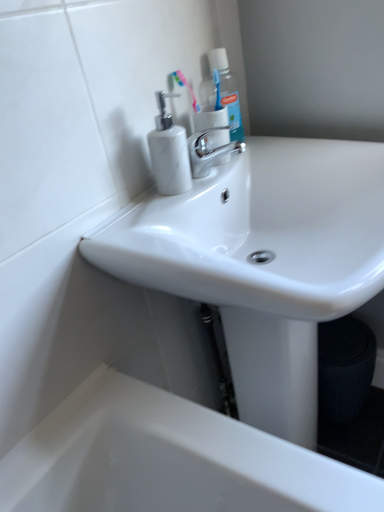
Measure the distance between point [203,95] and camera.

A distance of 37.20 inches exists between point [203,95] and camera.

What do you see at coordinates (169, 151) in the screenshot? I see `white marble soap dispenser at upper left` at bounding box center [169, 151].

Find the location of a particular element. white glossy sink at center is located at coordinates (264, 261).

The width and height of the screenshot is (384, 512). Find the location of `polished chrome faucet at center`. polished chrome faucet at center is located at coordinates (211, 150).

Who is taller, translucent plastic mouthwash at upper center or polished chrome faucet at center?

Standing taller between the two is translucent plastic mouthwash at upper center.

Is translucent plastic mouthwash at upper center facing towards polished chrome faucet at center?

No.

This screenshot has width=384, height=512. I want to click on tap below the translucent plastic mouthwash at upper center (from the image's perspective), so click(x=211, y=150).

Considering the sizes of objects white glossy toilet paper at upper center and pink plastic toothbrush at upper center in the image provided, who is thinner, white glossy toilet paper at upper center or pink plastic toothbrush at upper center?

pink plastic toothbrush at upper center.

Is white glossy toilet paper at upper center facing towards pink plastic toothbrush at upper center?

Answer: No.

Between point (212, 129) and point (197, 109), which one is positioned behind?

Positioned behind is point (197, 109).

Can you confirm if white glossy toilet paper at upper center is bigger than white glossy sink at center?

No.

Is white glossy toilet paper at upper center further to the viewer compared to white glossy sink at center?

Yes, white glossy toilet paper at upper center is behind white glossy sink at center.

From the picture: Which is more distant, (194, 120) or (270, 238)?

The point (270, 238) is farther.

Does white glossy toilet paper at upper center appear on the left side of white glossy sink at center?

Yes.

Does polished chrome faucet at center appear on the right side of translucent plastic mouthwash at upper center?

No.

Could you measure the distance between polished chrome faucet at center and translucent plastic mouthwash at upper center?

polished chrome faucet at center is 4.11 inches away from translucent plastic mouthwash at upper center.

Between polished chrome faucet at center and translucent plastic mouthwash at upper center, which one is positioned in front?

polished chrome faucet at center is in front.

Considering the sizes of polished chrome faucet at center and translucent plastic mouthwash at upper center in the image, is polished chrome faucet at center bigger or smaller than translucent plastic mouthwash at upper center?

Clearly, polished chrome faucet at center is smaller in size than translucent plastic mouthwash at upper center.

Is white glossy sink at center not near white marble soap dispenser at upper left?

No.

How different are the orientations of white glossy sink at center and white marble soap dispenser at upper left in degrees?

They differ by 1.76 degrees in their facing directions.

This screenshot has width=384, height=512. Find the location of `sink lying on the right of white marble soap dispenser at upper left`. sink lying on the right of white marble soap dispenser at upper left is located at coordinates 264,261.

Consider the image. Does white glossy sink at center have a larger size compared to white marble soap dispenser at upper left?

Yes, white glossy sink at center is bigger than white marble soap dispenser at upper left.

Is white glossy toilet paper at upper center placed right next to white marble soap dispenser at upper left?

No, white glossy toilet paper at upper center is not making contact with white marble soap dispenser at upper left.

Between point (225, 127) and point (163, 150), which one is positioned behind?

Point (225, 127)

How distant is white glossy toilet paper at upper center from white marble soap dispenser at upper left?

The distance of white glossy toilet paper at upper center from white marble soap dispenser at upper left is 4.41 inches.

Looking at the image, does white glossy toilet paper at upper center seem bigger or smaller compared to white marble soap dispenser at upper left?

Clearly, white glossy toilet paper at upper center is larger in size than white marble soap dispenser at upper left.

The width and height of the screenshot is (384, 512). Identify the location of toilet paper on the left of translucent plastic mouthwash at upper center. (212, 127).

From the image's perspective, would you say white glossy toilet paper at upper center is positioned over translucent plastic mouthwash at upper center?

No, from the image's perspective, white glossy toilet paper at upper center is not above translucent plastic mouthwash at upper center.

Can you tell me how much white glossy toilet paper at upper center and translucent plastic mouthwash at upper center differ in facing direction?

The angular difference between white glossy toilet paper at upper center and translucent plastic mouthwash at upper center is 5.34 degrees.

Looking at their sizes, would you say white glossy toilet paper at upper center is wider or thinner than translucent plastic mouthwash at upper center?

white glossy toilet paper at upper center is wider than translucent plastic mouthwash at upper center.

In the image, there is a polished chrome faucet at center. Where is `cleaning product above it (from the image's perspective)`? Image resolution: width=384 pixels, height=512 pixels. cleaning product above it (from the image's perspective) is located at coordinates (223, 91).

Locate an element on the screen. Image resolution: width=384 pixels, height=512 pixels. toothbrush located on the left of white glossy toilet paper at upper center is located at coordinates (187, 87).

Looking at the image, which one is located further to translucent plastic mouthwash at upper center, white glossy toilet paper at upper center or pink plastic toothbrush at upper center?

pink plastic toothbrush at upper center is further to translucent plastic mouthwash at upper center.

Estimate the real-world distances between objects in this image. Which object is closer to pink plastic toothbrush at upper center, white glossy toilet paper at upper center or white glossy sink at center?

white glossy toilet paper at upper center lies closer to pink plastic toothbrush at upper center than the other object.

Looking at the image, which one is located further to white marble soap dispenser at upper left, polished chrome faucet at center or pink plastic toothbrush at upper center?

The object further to white marble soap dispenser at upper left is pink plastic toothbrush at upper center.

From the image, which object appears to be farther from translucent plastic mouthwash at upper center, white glossy sink at center or pink plastic toothbrush at upper center?

white glossy sink at center is further to translucent plastic mouthwash at upper center.

Which object lies nearer to the anchor point polished chrome faucet at center, translucent plastic mouthwash at upper center or white glossy toilet paper at upper center?

Among the two, white glossy toilet paper at upper center is located nearer to polished chrome faucet at center.

Considering their positions, is white glossy toilet paper at upper center positioned closer to white marble soap dispenser at upper left than polished chrome faucet at center?

polished chrome faucet at center lies closer to white marble soap dispenser at upper left than the other object.

Which object lies nearer to the anchor point translucent plastic mouthwash at upper center, pink plastic toothbrush at upper center or white marble soap dispenser at upper left?

pink plastic toothbrush at upper center lies closer to translucent plastic mouthwash at upper center than the other object.

Based on their spatial positions, is white marble soap dispenser at upper left or polished chrome faucet at center further from pink plastic toothbrush at upper center?

white marble soap dispenser at upper left.

Locate an element on the screen. This screenshot has width=384, height=512. soap dispenser between polished chrome faucet at center and white glossy sink at center from top to bottom is located at coordinates (169, 151).

This screenshot has height=512, width=384. I want to click on toilet paper between pink plastic toothbrush at upper center and white glossy sink at center vertically, so click(x=212, y=127).

Find the location of a particular element. tap between translucent plastic mouthwash at upper center and white marble soap dispenser at upper left vertically is located at coordinates (211, 150).

At what (x,y) coordinates should I click in order to perform the action: click on toilet paper between translucent plastic mouthwash at upper center and white marble soap dispenser at upper left from top to bottom. Please return your answer as a coordinate pair (x, y). The height and width of the screenshot is (512, 384). Looking at the image, I should click on tap(212, 127).